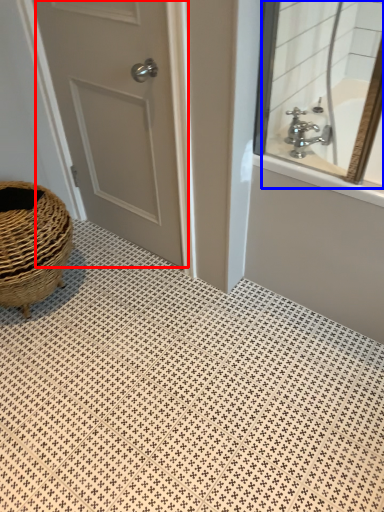
Question: Which object is closer to the camera taking this photo, door (highlighted by a red box) or mirror (highlighted by a blue box)?

Choices:
 (A) door
 (B) mirror

Answer: (A)